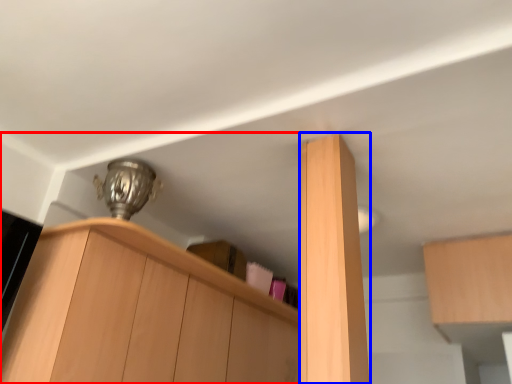
Question: Which object appears closest to the camera in this image, cabinetry (highlighted by a red box) or cabinetry (highlighted by a blue box)?

Choices:
 (A) cabinetry
 (B) cabinetry

Answer: (B)